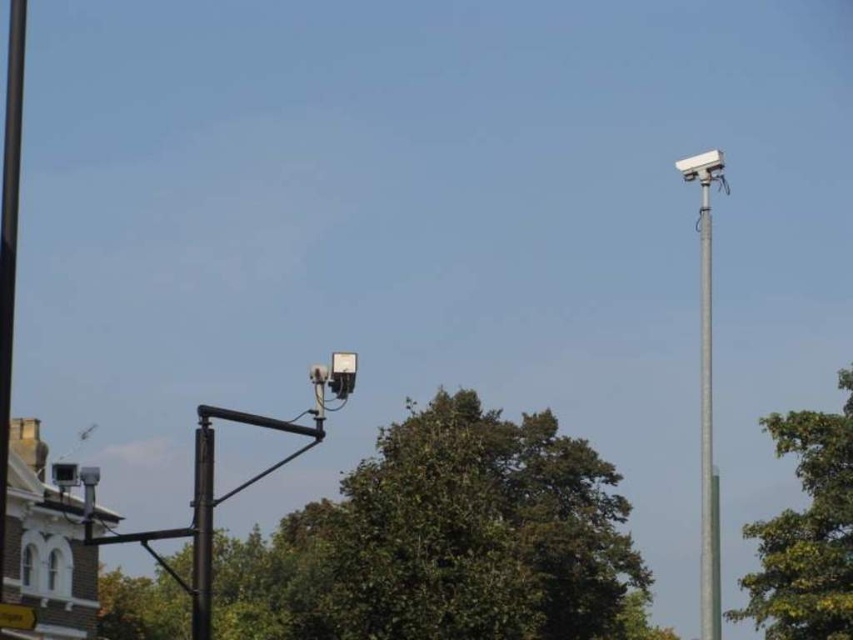
You are a landscape designer planning to install a new pathway between the green leafy tree at center and the black metal pole at center. Considering their widths, which object might require more space to accommodate on either side of the pathway?

The green leafy tree at center has a greater width than the black metal pole at center, so it would require more space on either side of the pathway.

You are a technician assessing the installation of two security cameras. You notice the black metal pole at center and the silver metallic pole at upper right. Which pole is closer to the technician standing in front of them?

The silver metallic pole at upper right is closer to the technician because the black metal pole at center is behind it.

You are a maintenance worker checking the security cameras. You notice the green leafy tree at center and the black metal pole at center. Which object is located lower in the image?

The green leafy tree at center is positioned under the black metal pole at center, so it is located lower in the image.